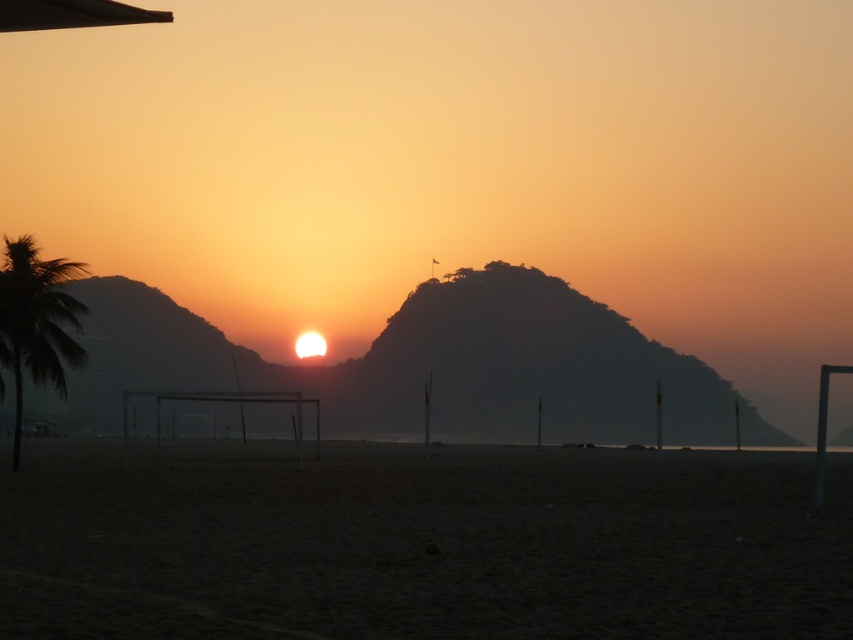
Question: Observing the image, what is the correct spatial positioning of dark sand at lower center in reference to green leafy palm tree at left?

Choices:
 (A) left
 (B) right

Answer: (B)

Question: Estimate the real-world distances between objects in this image. Which object is closer to the dark sand at lower center?

Choices:
 (A) silhouette rock at center
 (B) green leafy palm tree at left

Answer: (B)

Question: Can you confirm if dark sand at lower center is smaller than silhouette rock at center?

Choices:
 (A) yes
 (B) no

Answer: (A)

Question: Which point is farther from the camera taking this photo?

Choices:
 (A) (503, 310)
 (B) (239, 609)
 (C) (28, 346)

Answer: (A)

Question: Based on their relative distances, which object is farther from the dark sand at lower center?

Choices:
 (A) green leafy palm tree at left
 (B) silhouette rock at center

Answer: (B)

Question: Does dark sand at lower center appear on the left side of green leafy palm tree at left?

Choices:
 (A) no
 (B) yes

Answer: (A)